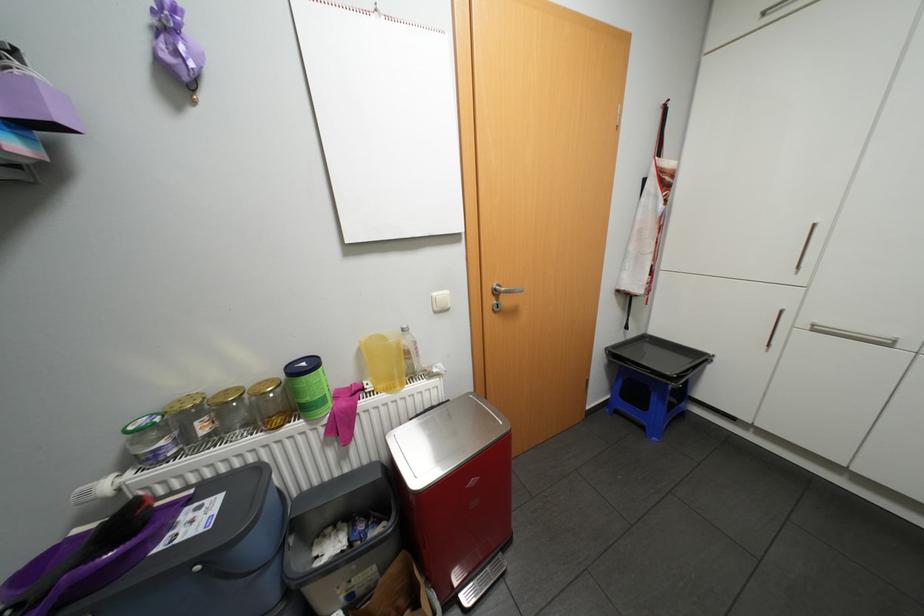
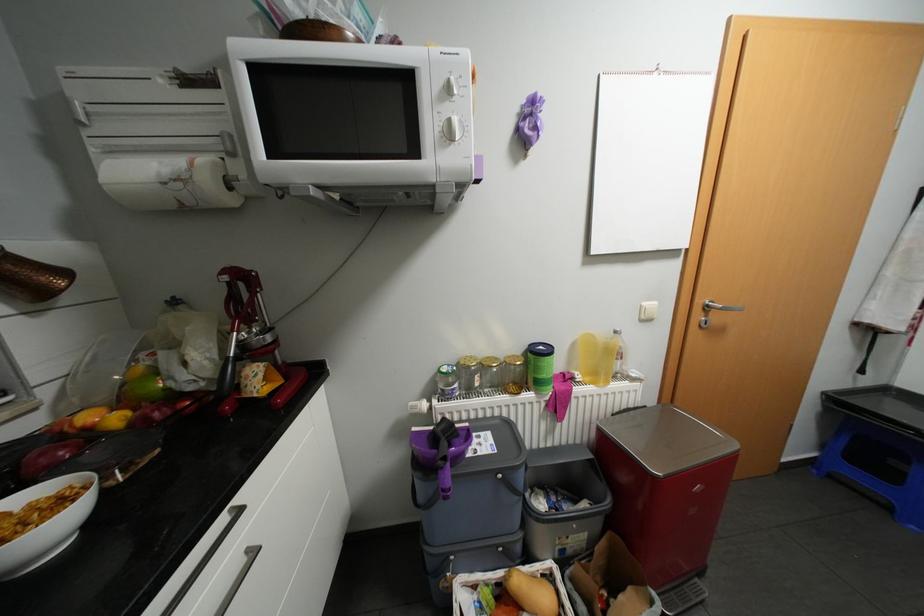
The point at (444, 310) is marked in the first image. Where is the corresponding point in the second image?

(649, 320)